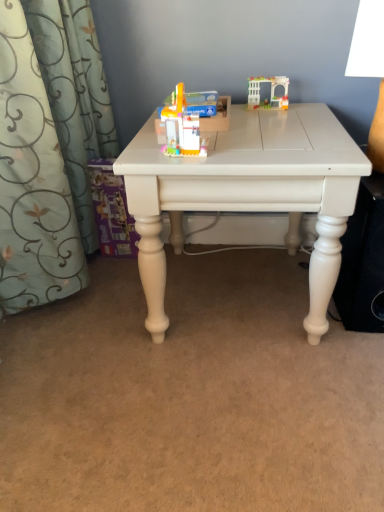
Identify the location of vacant area that lies to the right of translucent plastic toy at center, acting as the second toy starting from the top. (256, 145).